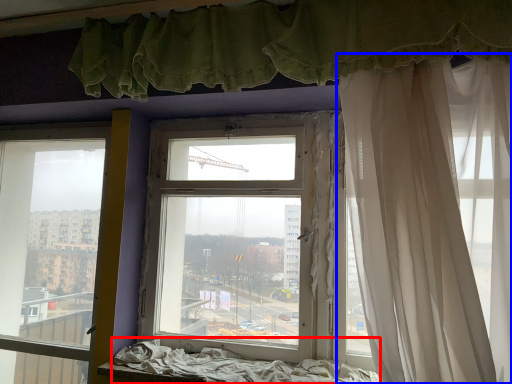
Question: Among these objects, which one is nearest to the camera, bed frame (highlighted by a red box) or curtain (highlighted by a blue box)?

Choices:
 (A) bed frame
 (B) curtain

Answer: (B)